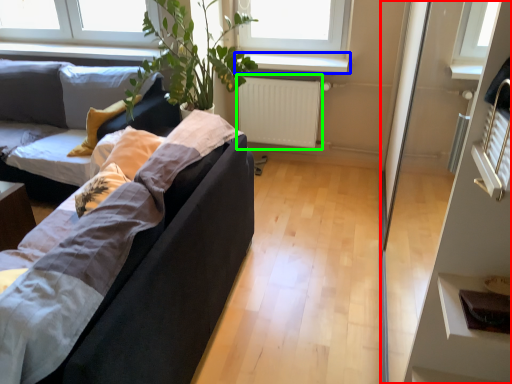
Question: Based on their relative distances, which object is farther from glass door (highlighted by a red box)? Choose from window sill (highlighted by a blue box) and radiator (highlighted by a green box).

Choices:
 (A) window sill
 (B) radiator

Answer: (B)